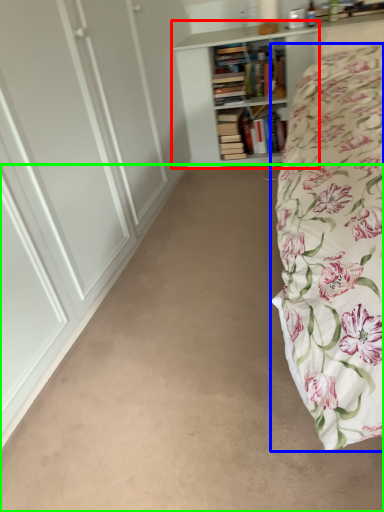
Question: Which object is positioned closest to bookcase (highlighted by a red box)? Select from bed (highlighted by a blue box) and plain (highlighted by a green box).

Choices:
 (A) bed
 (B) plain

Answer: (A)